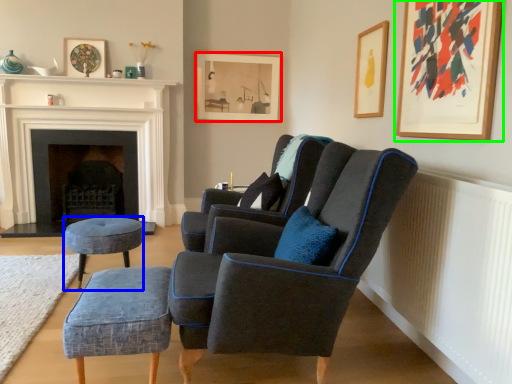
Question: Based on their relative distances, which object is nearer to picture frame (highlighted by a red box)? Choose from stool (highlighted by a blue box) and picture frame (highlighted by a green box).

Choices:
 (A) stool
 (B) picture frame

Answer: (A)